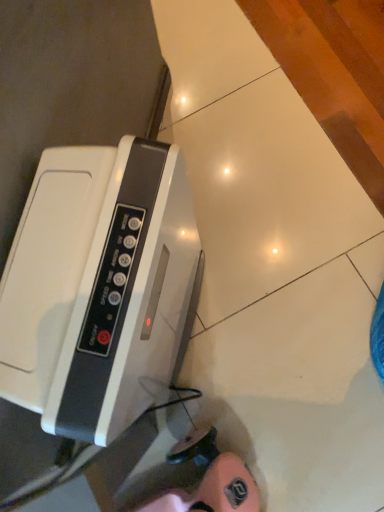
Locate an element on the screen. The image size is (384, 512). white plastic air purifier at left is located at coordinates (100, 287).

The height and width of the screenshot is (512, 384). What do you see at coordinates (100, 287) in the screenshot? I see `white plastic air purifier at left` at bounding box center [100, 287].

Identify the location of white plastic air purifier at left. (100, 287).